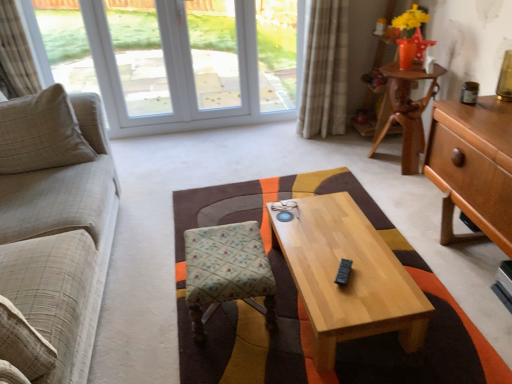
Image resolution: width=512 pixels, height=384 pixels. Identify the location of free spot above light wood/texture coffee table at center (from a real-world perspective). (337, 247).